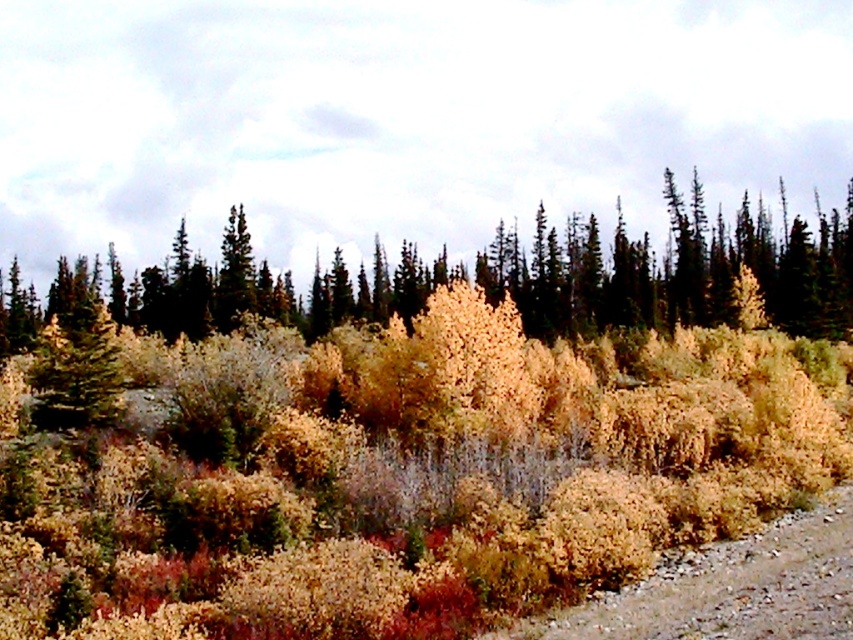
You are standing in the forest depicted in the scene. You notice a point marked at coordinates (x=395, y=451). What type of vegetation is located at that specific point?

The point at (x=395, y=451) has golden dry shrubs at center.

You are standing at the point marked as point (x=676, y=272) in the forest scene. What type of vegetation are you currently standing on?

The point (x=676, y=272) corresponds to a golden textured shrub at center, so you are standing on a golden textured shrub at center.

You are navigating through the forest depicted in the image and want to reach a specific location. You are currently at point 1, which is point (57,310), and need to move towards point 2, which is point (682,618). Based on the forest layout, will you have to go deeper into the forest or come closer to the foreground as you move from point 1 to point 2?

Since point 1 is further to the viewer than point 2, moving from point 1 to point 2 means you are going deeper into the forest away from the foreground.